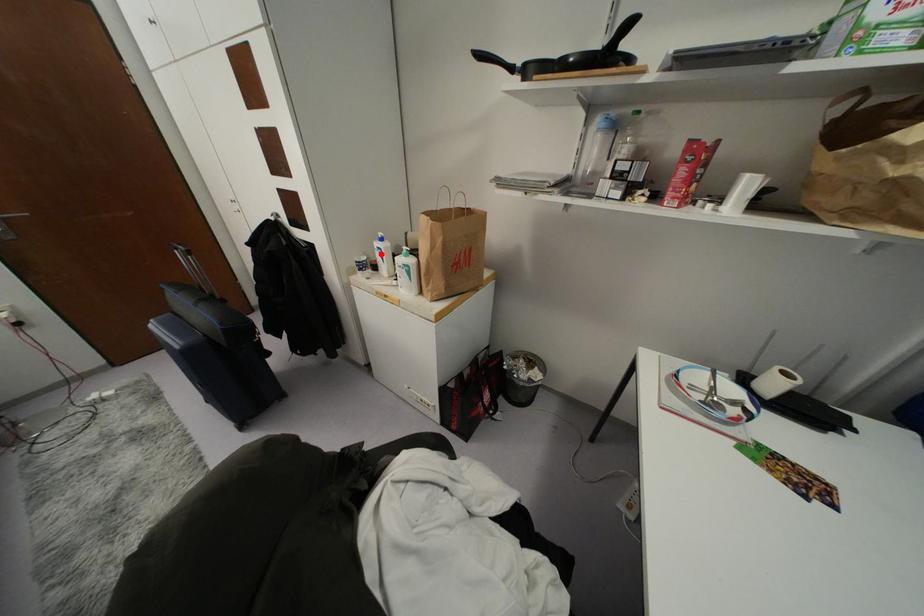
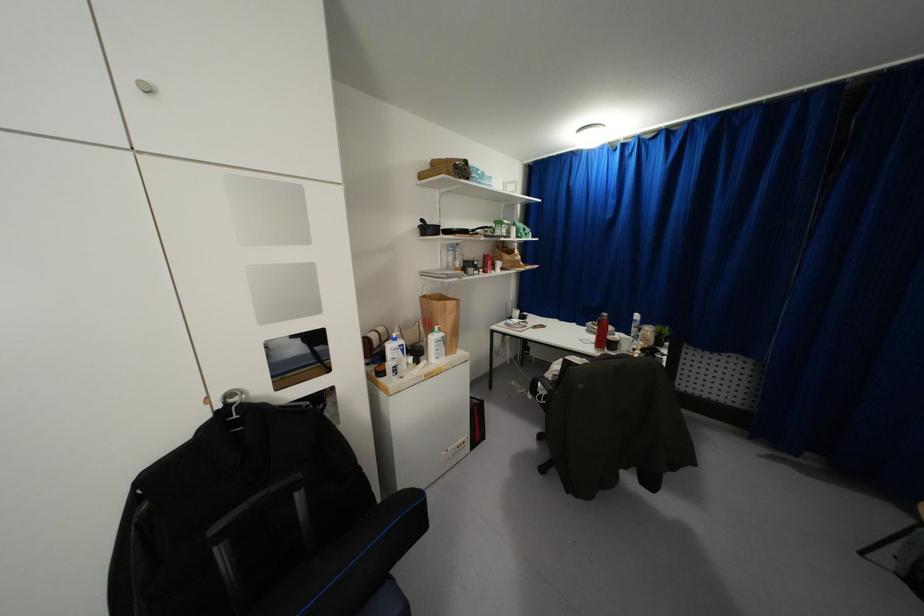
In the second image, find the point that corresponds to the highlighted location in the first image.

(402, 350)